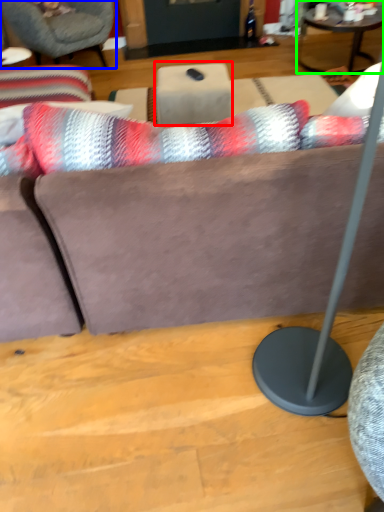
Question: Which object is the farthest from table (highlighted by a red box)? Choose among these: chair (highlighted by a blue box) or coffee table (highlighted by a green box).

Choices:
 (A) chair
 (B) coffee table

Answer: (B)